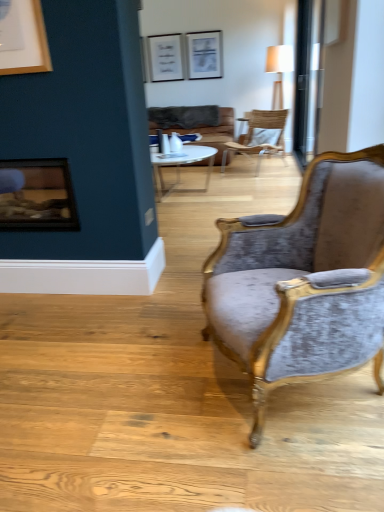
Question: Which direction should I rotate to look at velvet grey chair at center, acting as the second chair starting from the top?

Choices:
 (A) right
 (B) left

Answer: (A)

Question: Considering the relative sizes of wooden textured chair at center, marked as the 2th chair in a bottom-to-top arrangement, and wooden frame fireplace at left in the image provided, is wooden textured chair at center, marked as the 2th chair in a bottom-to-top arrangement, shorter than wooden frame fireplace at left?

Choices:
 (A) yes
 (B) no

Answer: (B)

Question: Does wooden textured chair at center, marked as the 2th chair in a bottom-to-top arrangement, have a greater height compared to wooden frame fireplace at left?

Choices:
 (A) yes
 (B) no

Answer: (A)

Question: From a real-world perspective, is wooden textured chair at center, marked as the 2th chair in a bottom-to-top arrangement, positioned under wooden frame fireplace at left based on gravity?

Choices:
 (A) yes
 (B) no

Answer: (A)

Question: Can you confirm if wooden textured chair at center, the first chair positioned from the top, is bigger than wooden frame fireplace at left?

Choices:
 (A) yes
 (B) no

Answer: (A)

Question: Are wooden textured chair at center, which is the 1th chair from back to front, and wooden frame fireplace at left far apart?

Choices:
 (A) no
 (B) yes

Answer: (B)

Question: Is wooden textured chair at center, the 2th chair positioned from the front, touching wooden frame fireplace at left?

Choices:
 (A) yes
 (B) no

Answer: (B)

Question: Is wooden frame fireplace at left to the left of velvet grey chair at center, the 2th chair viewed from the back, from the viewer's perspective?

Choices:
 (A) no
 (B) yes

Answer: (B)

Question: Is velvet grey chair at center, which is the first chair from bottom to top, a part of wooden frame fireplace at left?

Choices:
 (A) no
 (B) yes

Answer: (A)

Question: Is wooden frame fireplace at left bigger than velvet grey chair at center, acting as the second chair starting from the top?

Choices:
 (A) yes
 (B) no

Answer: (B)

Question: Can you confirm if wooden frame fireplace at left is positioned to the right of velvet grey chair at center, which is the first chair from bottom to top?

Choices:
 (A) yes
 (B) no

Answer: (B)

Question: From the image's perspective, is wooden frame fireplace at left on velvet grey chair at center, the 2th chair viewed from the back?

Choices:
 (A) no
 (B) yes

Answer: (B)

Question: Is wooden frame fireplace at left facing away from velvet grey chair at center, the 2th chair viewed from the back?

Choices:
 (A) yes
 (B) no

Answer: (B)

Question: Is wooden frame fireplace at left at the right side of brown leather couch at center?

Choices:
 (A) no
 (B) yes

Answer: (A)